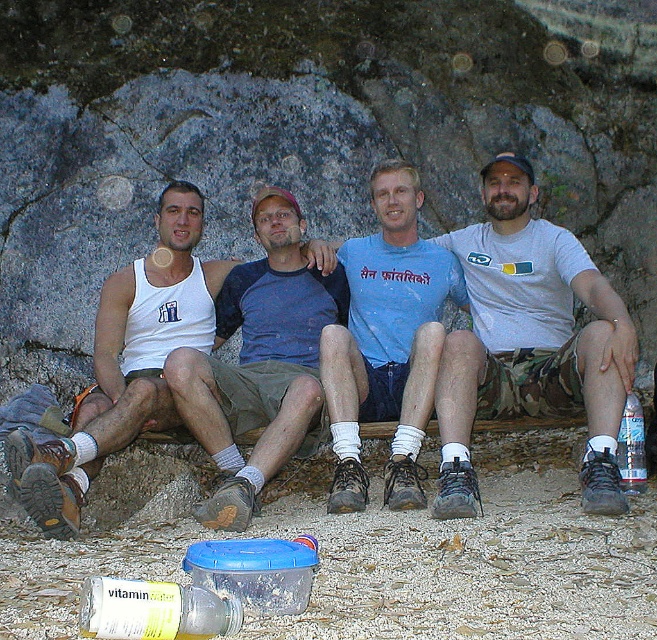
Is white fabric tank top at center bigger than clear plastic bottle at lower right?

Correct, white fabric tank top at center is larger in size than clear plastic bottle at lower right.

Does white fabric tank top at center appear under clear plastic bottle at lower right?

Actually, white fabric tank top at center is above clear plastic bottle at lower right.

In the scene shown: Measure the distance between white fabric tank top at center and camera.

6.85 meters

At what (x,y) coordinates should I click in order to perform the action: click on white fabric tank top at center. Please return your answer as a coordinate pair (x, y). The width and height of the screenshot is (657, 640). Looking at the image, I should click on (260, 362).

Is gray cotton t-shirt at center taller than white cotton tank top at left?

In fact, gray cotton t-shirt at center may be shorter than white cotton tank top at left.

Is gray cotton t-shirt at center wider than white cotton tank top at left?

Indeed, gray cotton t-shirt at center has a greater width compared to white cotton tank top at left.

Which is in front, point (516, 225) or point (129, 404)?

Point (129, 404)

The image size is (657, 640). Identify the location of gray cotton t-shirt at center. (530, 340).

Does white cotton tank top at left appear under clear plastic bottle at lower right?

No.

Who is more forward, (83, 435) or (639, 481)?

Positioned in front is point (83, 435).

This screenshot has width=657, height=640. I want to click on white cotton tank top at left, so click(x=125, y=364).